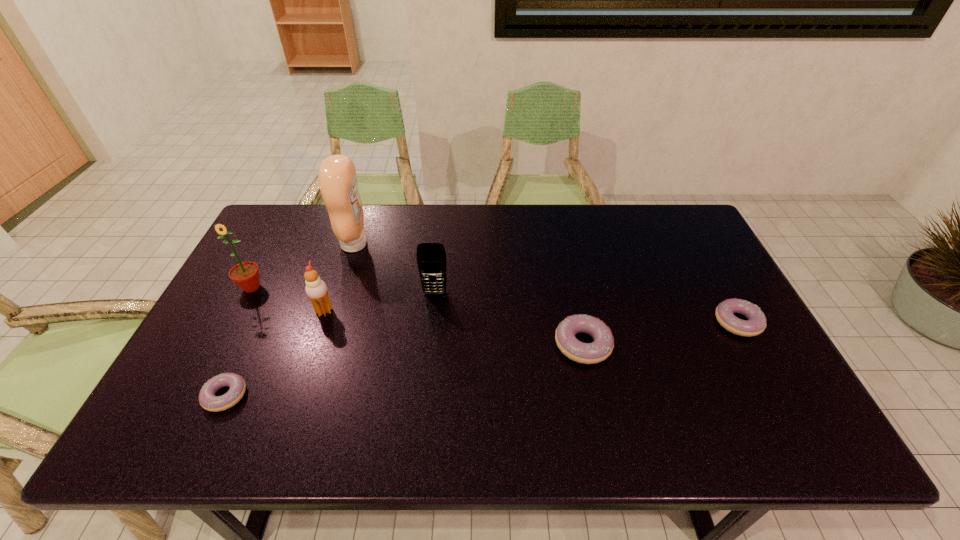
You are a GUI agent. You are given a task and a screenshot of the screen. Output one action in this format:
    pyautogui.click(x=<x>, y=<y>)
    Task: Click on the leftmost doughnut
    The image size is (960, 540).
    Given the screenshot: What is the action you would take?
    pyautogui.click(x=208, y=400)

Where is `the nearest object`? This screenshot has height=540, width=960. the nearest object is located at coordinates (208, 400).

This screenshot has width=960, height=540. What are the coordinates of `the third shortest object` in the screenshot? It's located at (587, 353).

At what (x,y) coordinates should I click in order to perform the action: click on the sixth object from left to right. Please return your answer as a coordinate pair (x, y). Looking at the image, I should click on (587, 353).

You are a GUI agent. You are given a task and a screenshot of the screen. Output one action in this format:
    pyautogui.click(x=<x>, y=<y>)
    Task: Click on the rightmost doughnut
    
    Given the screenshot: What is the action you would take?
    pyautogui.click(x=756, y=323)

At what (x,y) coordinates should I click in order to perform the action: click on the sixth tallest object. Please return your answer as a coordinate pair (x, y). The height and width of the screenshot is (540, 960). Looking at the image, I should click on tap(756, 323).

Locate an element on the screen. This screenshot has width=960, height=540. the second tallest object is located at coordinates (246, 274).

Where is `condiment`? condiment is located at coordinates (338, 183).

Identify the location of the farthest object. This screenshot has width=960, height=540. (338, 183).

Identify the location of cellular telephone. The image size is (960, 540). (431, 257).